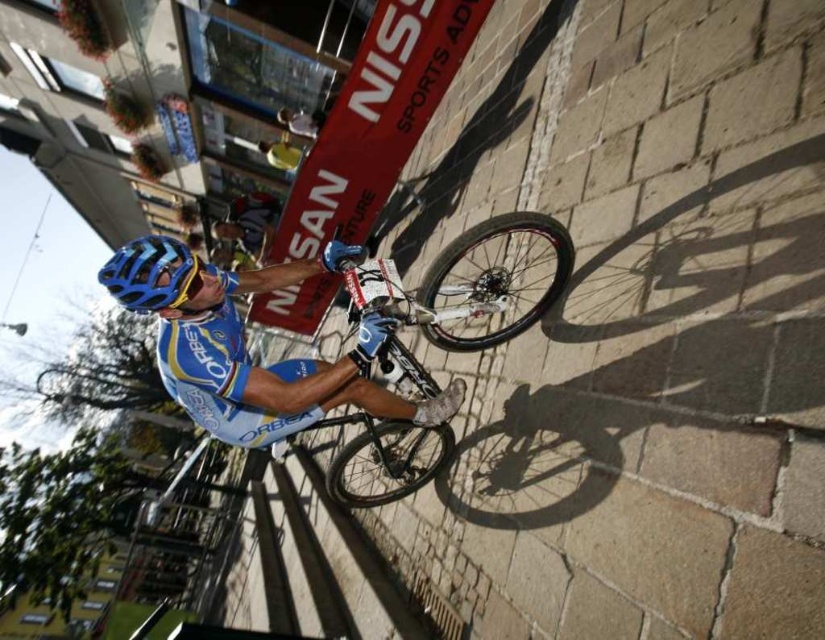
Question: Among these points, which one is nearest to the camera?

Choices:
 (A) (387, 266)
 (B) (192, 289)

Answer: (B)

Question: Among these objects, which one is farthest from the camera?

Choices:
 (A) shiny metallic bicycle at center
 (B) blue matte bicycle helmet at center

Answer: (A)

Question: Does shiny metallic bicycle at center lie in front of blue matte bicycle helmet at center?

Choices:
 (A) no
 (B) yes

Answer: (A)

Question: Does shiny metallic bicycle at center lie in front of blue matte bicycle helmet at center?

Choices:
 (A) no
 (B) yes

Answer: (A)

Question: Can you confirm if shiny metallic bicycle at center is positioned to the left of blue matte bicycle helmet at center?

Choices:
 (A) no
 (B) yes

Answer: (A)

Question: Which of the following is the farthest from the observer?

Choices:
 (A) shiny metallic bicycle at center
 (B) blue matte bicycle helmet at center

Answer: (A)